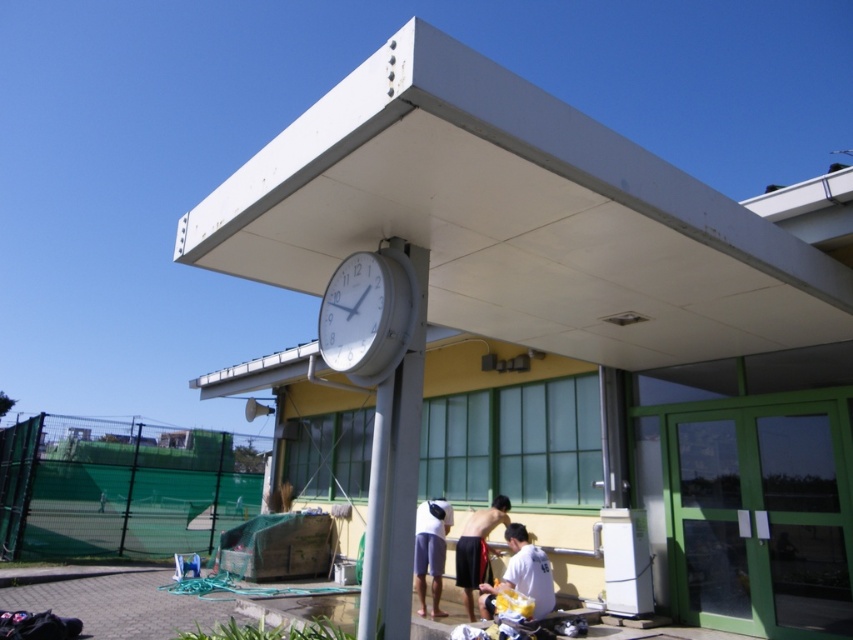
Question: Which object is positioned closest to the white matte shirt at lower center?

Choices:
 (A) shiny black shorts at lower center
 (B) white plastic clock at center

Answer: (A)

Question: Which object appears closest to the camera in this image?

Choices:
 (A) shiny black shorts at lower center
 (B) white matte shirt at lower center
 (C) white plastic clock at center
 (D) white matte shorts at lower center

Answer: (C)

Question: Does white matte shirt at lower center appear under white matte shorts at lower center?

Choices:
 (A) yes
 (B) no

Answer: (B)

Question: Can you confirm if white matte shirt at lower center is wider than shiny black shorts at lower center?

Choices:
 (A) no
 (B) yes

Answer: (B)

Question: Is white matte shirt at lower center to the right of shiny black shorts at lower center from the viewer's perspective?

Choices:
 (A) yes
 (B) no

Answer: (A)

Question: Based on their relative distances, which object is farther from the white matte shirt at lower center?

Choices:
 (A) white matte shorts at lower center
 (B) shiny black shorts at lower center

Answer: (A)